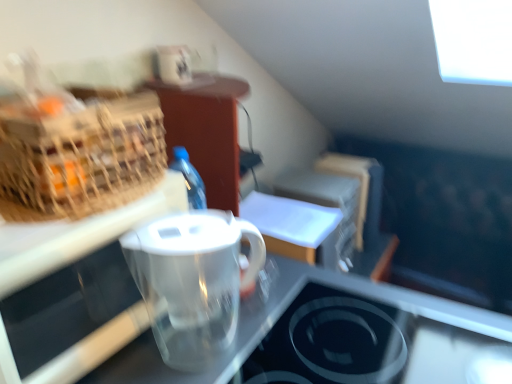
Question: Is woven straw picnic basket at left completely or partially outside of transparent plastic pitcher at center?

Choices:
 (A) no
 (B) yes

Answer: (B)

Question: Can you confirm if woven straw picnic basket at left is shorter than transparent plastic pitcher at center?

Choices:
 (A) yes
 (B) no

Answer: (B)

Question: Is woven straw picnic basket at left bigger than transparent plastic pitcher at center?

Choices:
 (A) no
 (B) yes

Answer: (B)

Question: Is woven straw picnic basket at left wider than transparent plastic pitcher at center?

Choices:
 (A) no
 (B) yes

Answer: (B)

Question: Considering the relative sizes of woven straw picnic basket at left and transparent plastic pitcher at center in the image provided, is woven straw picnic basket at left smaller than transparent plastic pitcher at center?

Choices:
 (A) no
 (B) yes

Answer: (A)

Question: In the image, is transparent plastic pitcher at center positioned in front of or behind transparent plastic pitcher at center?

Choices:
 (A) behind
 (B) front

Answer: (A)

Question: Considering the positions of transparent plastic pitcher at center and transparent plastic pitcher at center in the image, is transparent plastic pitcher at center wider or thinner than transparent plastic pitcher at center?

Choices:
 (A) wide
 (B) thin

Answer: (B)

Question: Looking at the image, does transparent plastic pitcher at center seem bigger or smaller compared to transparent plastic pitcher at center?

Choices:
 (A) small
 (B) big

Answer: (A)

Question: From the image's perspective, relative to transparent plastic pitcher at center, is transparent plastic pitcher at center above or below?

Choices:
 (A) below
 (B) above

Answer: (B)

Question: From their relative heights in the image, would you say transparent plastic pitcher at center is taller or shorter than transparent plastic pitcher at center?

Choices:
 (A) tall
 (B) short

Answer: (A)

Question: In terms of width, does transparent plastic pitcher at center look wider or thinner when compared to transparent plastic pitcher at center?

Choices:
 (A) wide
 (B) thin

Answer: (A)

Question: Would you say transparent plastic pitcher at center is inside or outside transparent plastic pitcher at center?

Choices:
 (A) outside
 (B) inside

Answer: (A)

Question: Considering the positions of transparent plastic pitcher at center and transparent plastic pitcher at center in the image, is transparent plastic pitcher at center bigger or smaller than transparent plastic pitcher at center?

Choices:
 (A) small
 (B) big

Answer: (B)

Question: Considering the positions of point (217, 319) and point (308, 324), is point (217, 319) closer or farther from the camera than point (308, 324)?

Choices:
 (A) closer
 (B) farther

Answer: (A)

Question: From a real-world perspective, is transparent plastic pitcher at center positioned above or below transparent glass stovetop at lower center?

Choices:
 (A) above
 (B) below

Answer: (A)